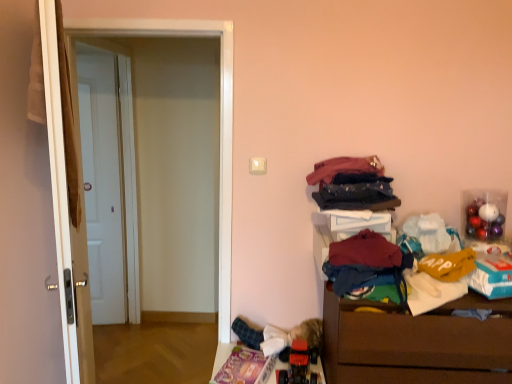
Question: Considering their positions, is white glossy door at left located in front of or behind dark red fabric at lower right, which appears as the 1th clothing when ordered from the bottom?

Choices:
 (A) front
 (B) behind

Answer: (B)

Question: Is point (109, 26) closer or farther from the camera than point (361, 243)?

Choices:
 (A) closer
 (B) farther

Answer: (B)

Question: Which object is the farthest from the white glossy door at left, arranged as the second door when viewed from the back?

Choices:
 (A) dark blue denim jeans at upper right, positioned as the third clothing in bottom-to-top order
 (B) white matte door at left, the first door from the back
 (C) brown wooden chest of drawers at lower right
 (D) dark red fabric at lower right, arranged as the third clothing when viewed from the top
 (E) red plastic toy car at lower center

Answer: (B)

Question: Which object is the farthest from the white matte door at left, which appears as the 2th door when viewed from the front?

Choices:
 (A) brown wooden chest of drawers at lower right
 (B) red plastic toy car at lower center
 (C) white glossy door at left, acting as the 1th door starting from the front
 (D) dark blue denim jeans at upper right, positioned as the third clothing in bottom-to-top order
 (E) dark red fabric at lower right, arranged as the third clothing when viewed from the top

Answer: (A)